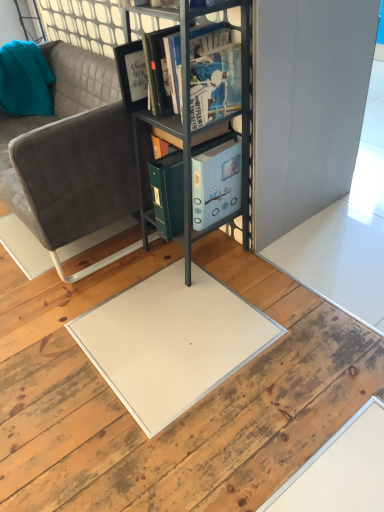
Question: Is gray fabric couch at center bigger or smaller than teal fabric pillow at upper left?

Choices:
 (A) small
 (B) big

Answer: (B)

Question: Considering the relative positions of gray fabric couch at center and teal fabric pillow at upper left in the image provided, is gray fabric couch at center to the left or to the right of teal fabric pillow at upper left?

Choices:
 (A) right
 (B) left

Answer: (A)

Question: Which object is positioned closest to the metallic gray bookshelf at center?

Choices:
 (A) teal fabric pillow at upper left
 (B) gray fabric couch at center
 (C) metallic gray cabinet at center
 (D) matte black book at center

Answer: (C)

Question: Which of these objects is positioned closest to the teal fabric pillow at upper left?

Choices:
 (A) gray fabric couch at center
 (B) matte black book at center
 (C) metallic gray bookshelf at center
 (D) metallic gray cabinet at center

Answer: (A)